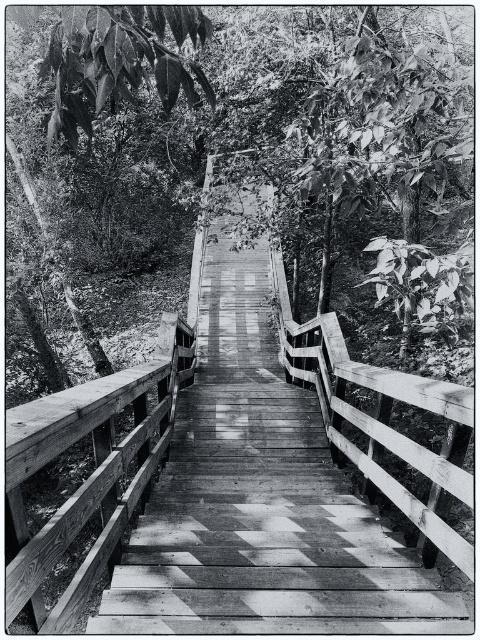
You are standing at the bottom of the wooden staircase and looking upwards. You see the smooth green leaves at upper center and the wooden bridge at center. Which object is closer to you?

The smooth green leaves at upper center are closer to you because they are positioned further to the viewer than the wooden bridge at center.

You are standing at the bottom of the staircase and looking upwards. Which object do you see first as you look up the staircase? The smooth green leaves at upper center or the wooden bridge at center?

The smooth green leaves at upper center is positioned over the wooden bridge at center, so you would see the smooth green leaves at upper center first as you look up the staircase.

You are standing at the base of the wooden staircase in the forest. There is a point marked at coordinates point (111,243). Can you reach that point by walking straight ahead along the staircase?

The distance between point (111,243) and the viewer is 16.18 meters. Since the staircase leads upwards into the forest and you are at the base, walking straight ahead along the staircase would allow you to reach the point as it lies along your path.